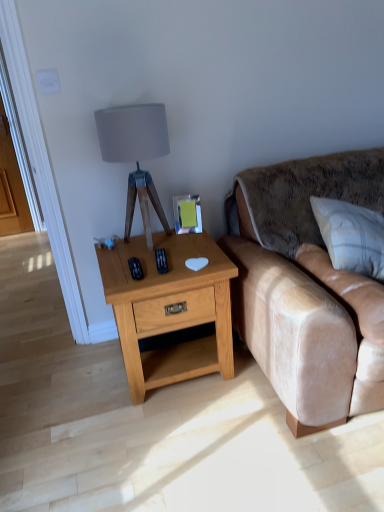
Question: From the image's perspective, is light oak wood nightstand at center above or below matte gray fabric lampshade at upper center?

Choices:
 (A) above
 (B) below

Answer: (B)

Question: Considering their positions, is light oak wood nightstand at center located in front of or behind matte gray fabric lampshade at upper center?

Choices:
 (A) front
 (B) behind

Answer: (A)

Question: Which object is the closest to the velvet beige couch at right?

Choices:
 (A) white textured pillow at right
 (B) matte gray fabric lampshade at upper center
 (C) light oak wood nightstand at center

Answer: (A)

Question: Which of these objects is positioned closest to the matte gray fabric lampshade at upper center?

Choices:
 (A) velvet beige couch at right
 (B) white textured pillow at right
 (C) light oak wood nightstand at center

Answer: (C)